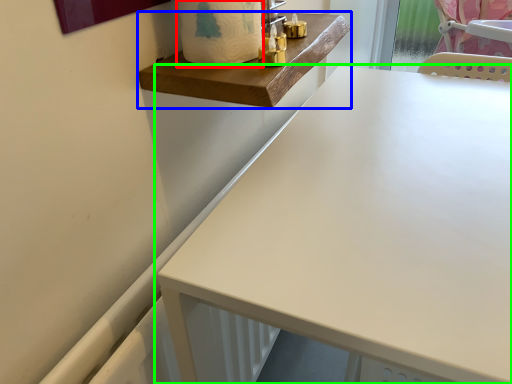
Question: Estimate the real-world distances between objects in this image. Which object is farther from toilet paper (highlighted by a red box), changing table (highlighted by a blue box) or table (highlighted by a green box)?

Choices:
 (A) changing table
 (B) table

Answer: (B)